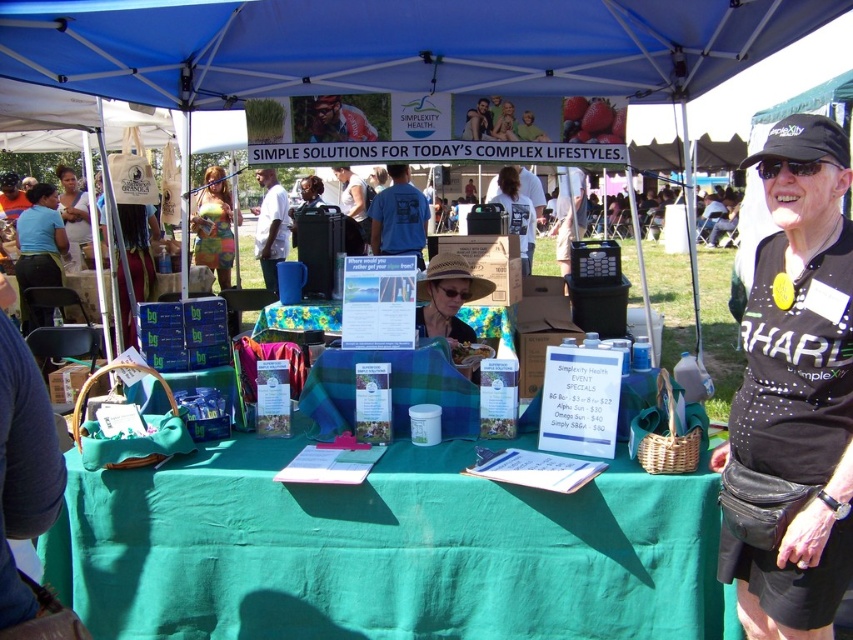
Is point (339, 180) closer to camera compared to point (508, 138)?

No, it is behind (508, 138).

Between matte blue shirt at center and matte black hat at upper center, which one appears on the right side from the viewer's perspective?

Positioned to the right is matte black hat at upper center.

Between point (363, 189) and point (508, 125), which one is positioned in front?

Point (508, 125)

This screenshot has width=853, height=640. I want to click on matte blue shirt at center, so click(352, 196).

Is floral fabric tablecloth at center bigger than blue cotton t-shirt at center?

Incorrect, floral fabric tablecloth at center is not larger than blue cotton t-shirt at center.

Between floral fabric tablecloth at center and blue cotton t-shirt at center, which one appears on the left side from the viewer's perspective?

Positioned to the left is floral fabric tablecloth at center.

This screenshot has width=853, height=640. I want to click on floral fabric tablecloth at center, so click(299, 316).

Is blue cotton t-shirt at center smaller than multicolored fabric bag at center?

Indeed, blue cotton t-shirt at center has a smaller size compared to multicolored fabric bag at center.

Who is more forward, (x=409, y=198) or (x=190, y=220)?

Point (x=409, y=198) is in front.

Does point (415, 208) come in front of point (195, 244)?

Yes.

I want to click on blue cotton t-shirt at center, so click(x=398, y=216).